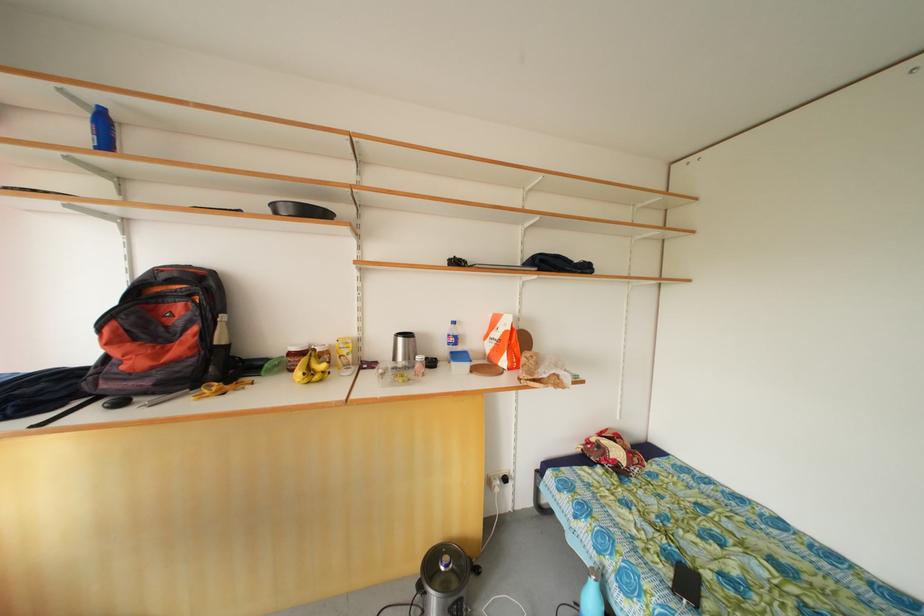
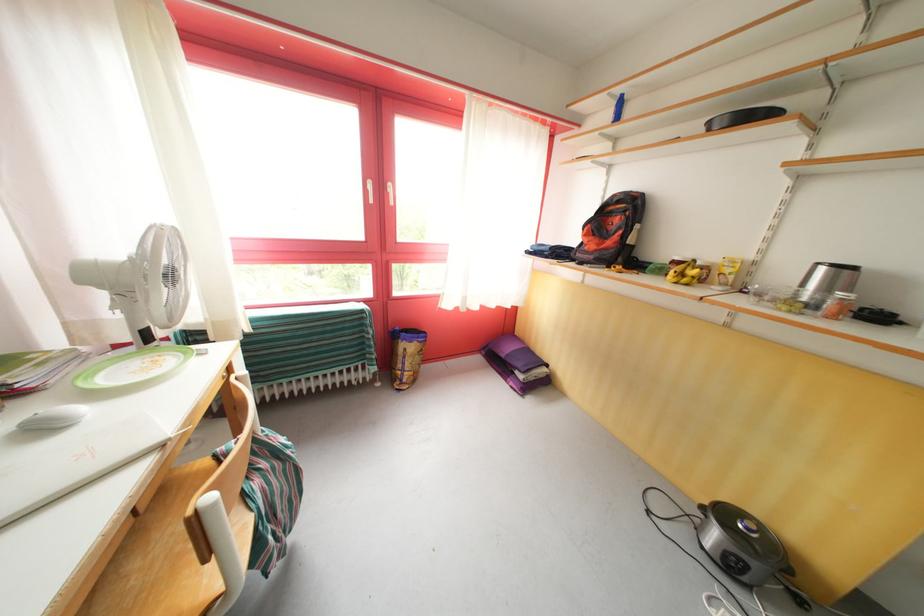
Where in the second image is the point corresponding to point 300,355 from the first image?

(684, 264)